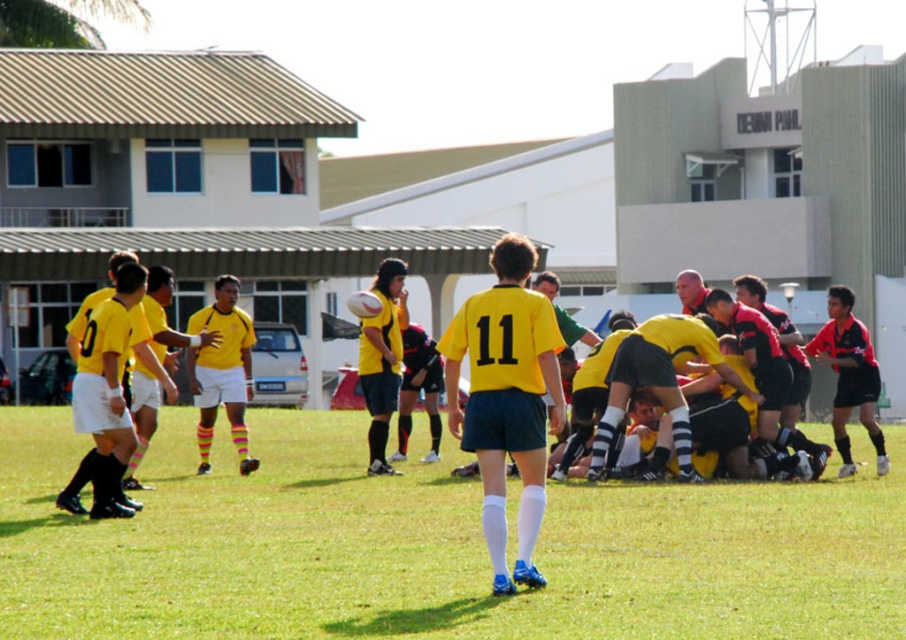
Question: Among these objects, which one is nearest to the camera?

Choices:
 (A) yellow matte jersey at center
 (B) green grass at center

Answer: (B)

Question: Which object is farther from the camera taking this photo?

Choices:
 (A) yellow matte jersey at center
 (B) green grass at center

Answer: (A)

Question: Is green grass at center closer to camera compared to yellow matte jersey at center?

Choices:
 (A) yes
 (B) no

Answer: (A)

Question: Does green grass at center appear on the right side of yellow matte jersey at center?

Choices:
 (A) no
 (B) yes

Answer: (B)

Question: Is green grass at center to the right of yellow matte jersey at center from the viewer's perspective?

Choices:
 (A) no
 (B) yes

Answer: (B)